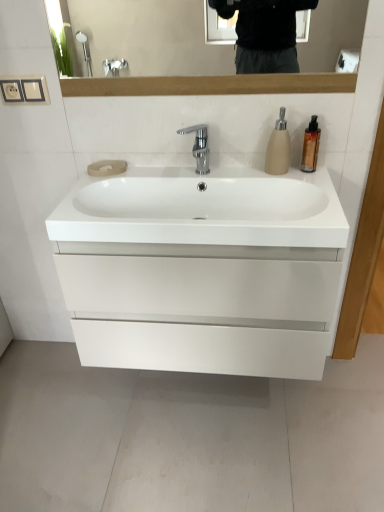
Identify the location of free space in front of matte beige soap dispenser at upper right, which ranks as the 1th soap dispenser in left-to-right order. (304, 182).